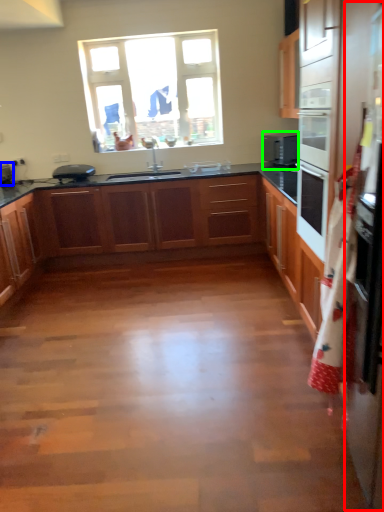
Question: Which object is positioned farthest from fridge (highlighted by a red box)? Select from appliance (highlighted by a blue box) and home appliance (highlighted by a green box).

Choices:
 (A) appliance
 (B) home appliance

Answer: (A)